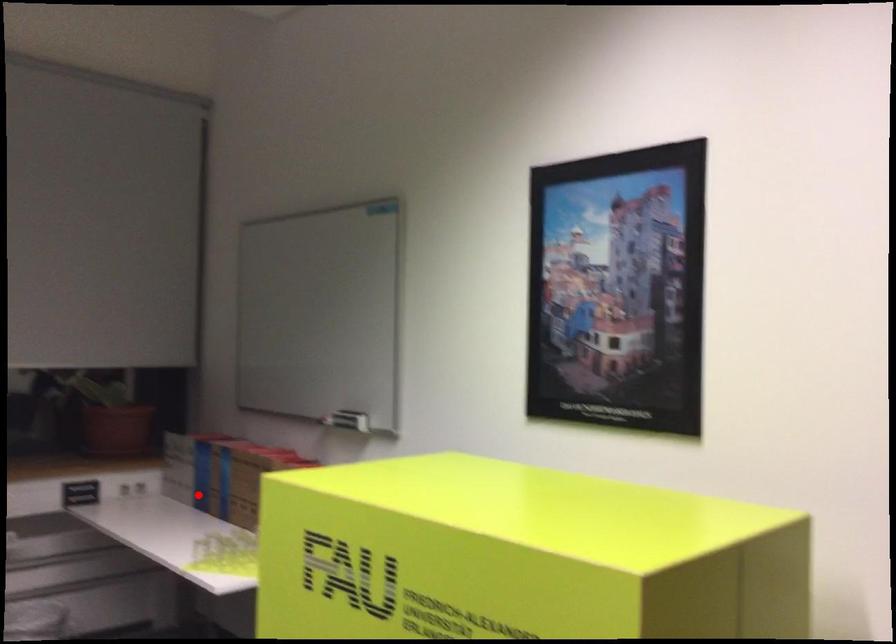
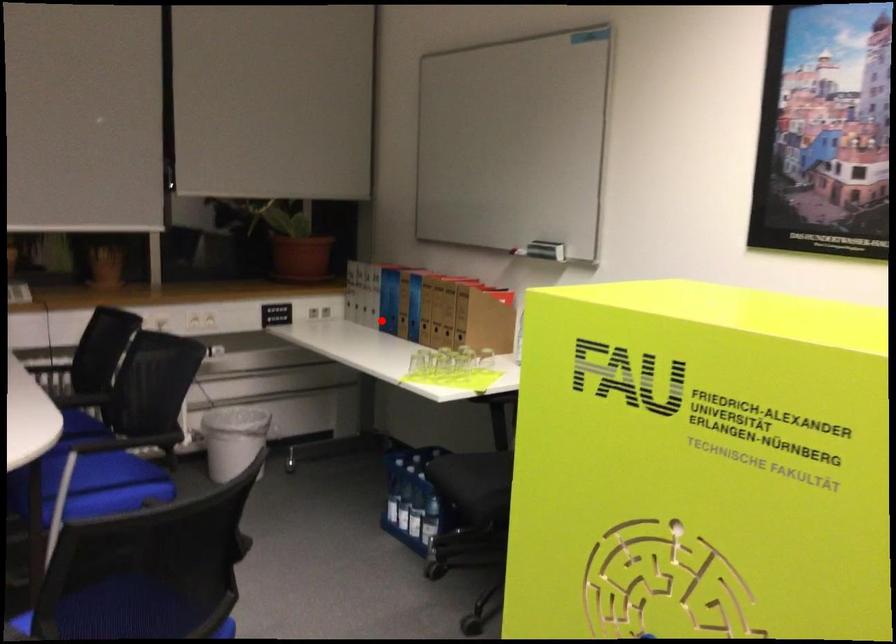
I am providing you with two images of the same scene from different viewpoints. A red point is marked on the first image and another point is marked on the second image. Does the point marked in image1 correspond to the same location as the one in image2?

Yes